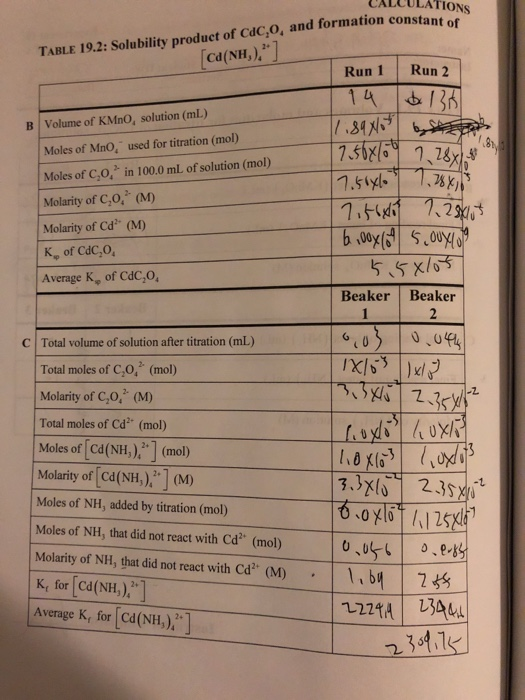
Identify the location of table b. (199, 218).